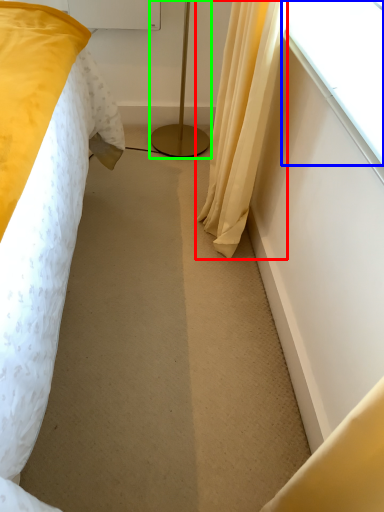
Question: Which object is positioned farthest from curtain (highlighted by a red box)? Select from window (highlighted by a blue box) and lamp (highlighted by a green box).

Choices:
 (A) window
 (B) lamp

Answer: (B)